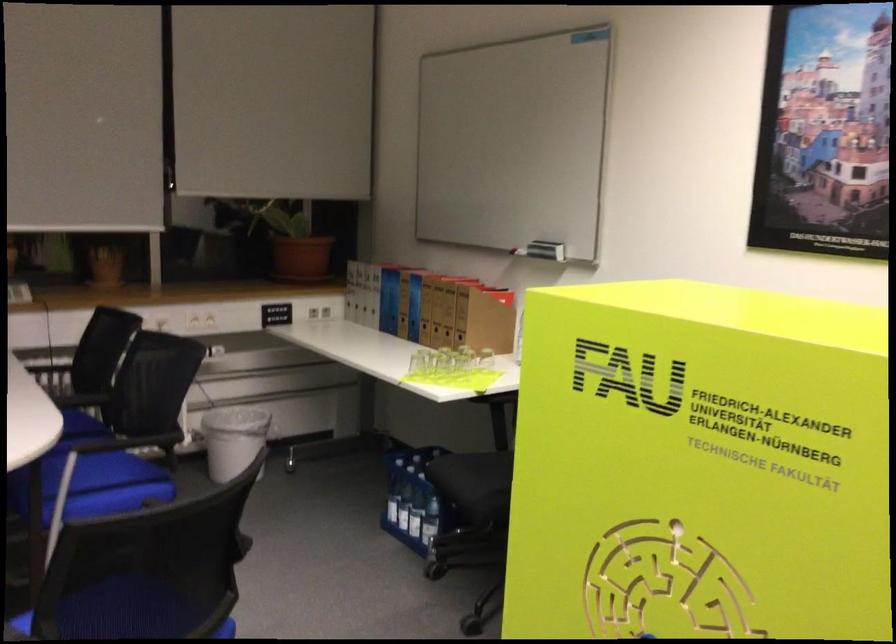
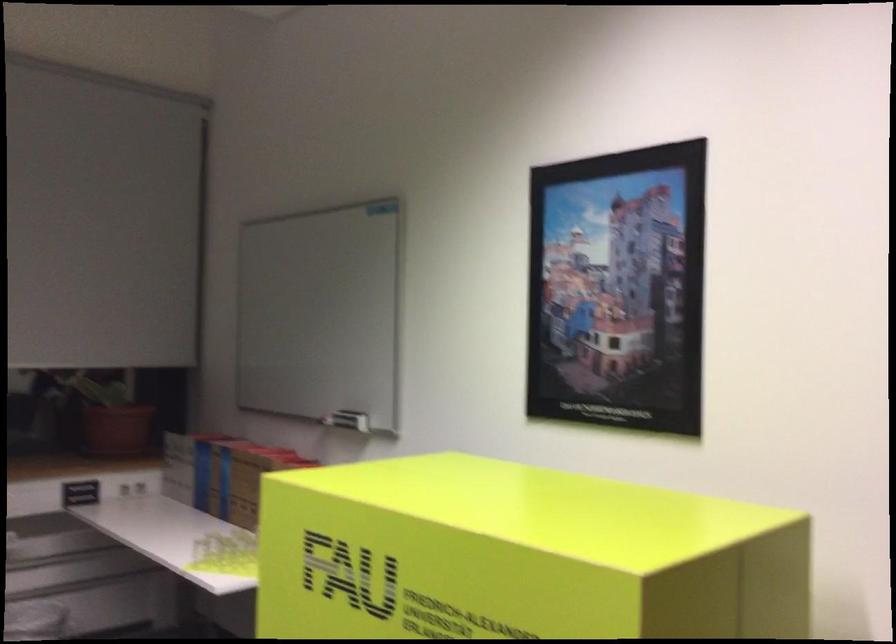
Question: Based on the continuous images, in which direction is the camera rotating? Reply with the corresponding letter.

Choices:
 (A) Left
 (B) Right
 (C) Up
 (D) Down

Answer: (C)